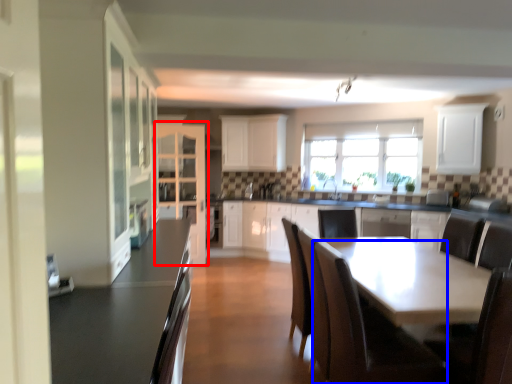
Question: Which point is further to the camera, cabinetry (highlighted by a red box) or chair (highlighted by a blue box)?

Choices:
 (A) cabinetry
 (B) chair

Answer: (A)